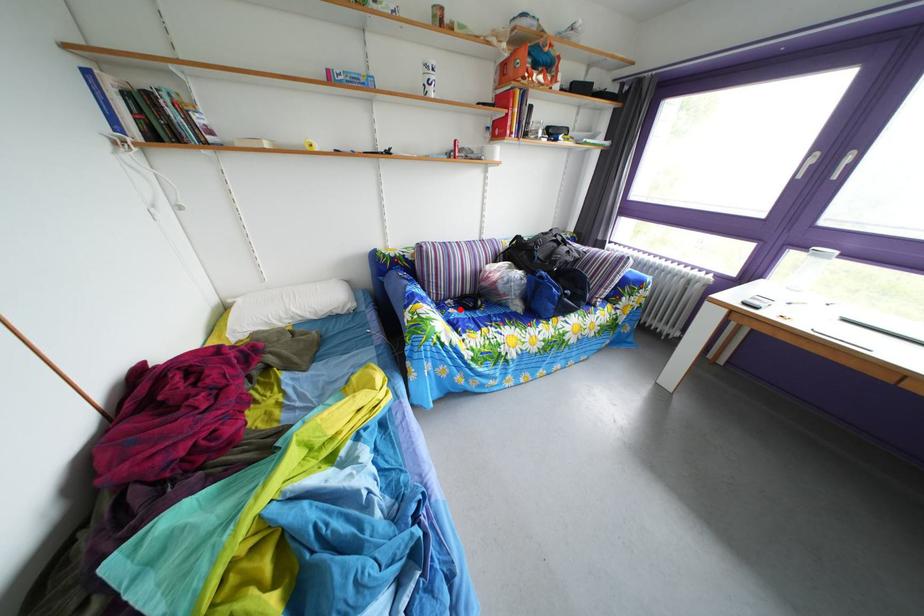
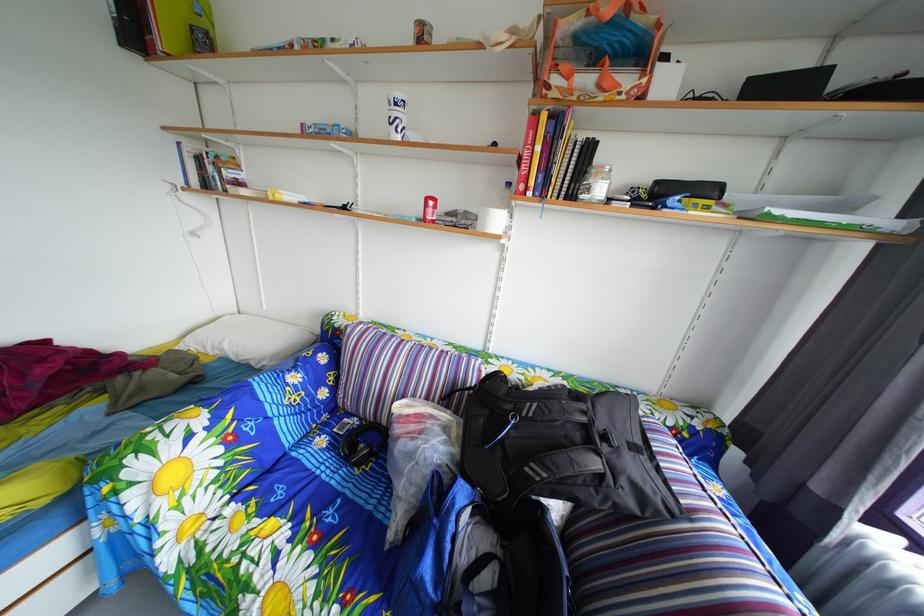
Question: I am providing you with two images of the same scene from different viewpoints. Image1 has a red point marked. In image2, the corresponding 3D location appears at what relative position? Reply with the corresponding letter.

Choices:
 (A) Closer
 (B) Farther

Answer: (B)